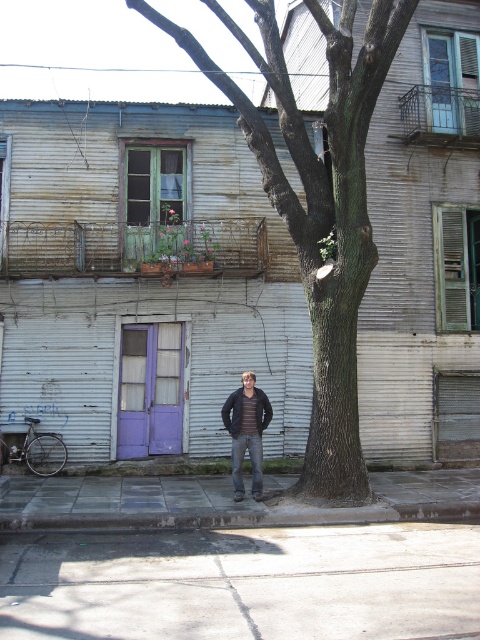
You are a delivery person trying to park your bike between the gray concrete curb at lower center and the dark gray jacket at center. Can you fit your bike there if the bike is 1.2 meters wide?

The gray concrete curb at lower center might be wider than dark gray jacket at center, but the exact width isn

You are a delivery person with a 1.2 meter wide cart. You need to pass between the smooth bark tree at center and the gray concrete curb at lower center to reach the purple door. Can your cart fit through the space between them?

The smooth bark tree at center is 4.72 meters away from the gray concrete curb at lower center. Since your cart is only 1.2 meters wide, it can easily fit through the space between them as the distance is much larger than the cart width.

You are a delivery person trying to park your bike near the gray concrete curb at lower center. The curb is marked at coordinates point (x=244, y=516). Can you confirm the exact location of the gray concrete curb at lower center based on the scene description?

The gray concrete curb at lower center is located at point (x=244, y=516).